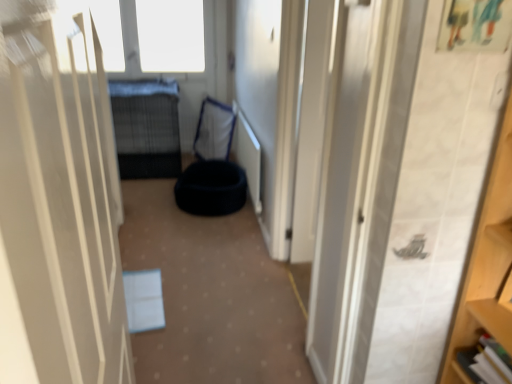
Question: From a real-world perspective, is black fabric bean bag at center, the 1th bean bag chair positioned from the front, beneath black fabric bean bag at center, the 2th bean bag chair positioned from the front?

Choices:
 (A) no
 (B) yes

Answer: (B)

Question: Considering the relative sizes of black fabric bean bag at center, the 1th bean bag chair positioned from the front, and black fabric bean bag at center, the 1th bean bag chair in the back-to-front sequence, in the image provided, is black fabric bean bag at center, the 1th bean bag chair positioned from the front, wider than black fabric bean bag at center, the 1th bean bag chair in the back-to-front sequence,?

Choices:
 (A) no
 (B) yes

Answer: (B)

Question: Is black fabric bean bag at center, arranged as the second bean bag chair when viewed from the back, further to camera compared to black fabric bean bag at center, the 2th bean bag chair positioned from the front?

Choices:
 (A) no
 (B) yes

Answer: (A)

Question: Does black fabric bean bag at center, the 1th bean bag chair positioned from the front, lie in front of black fabric bean bag at center, the 2th bean bag chair positioned from the front?

Choices:
 (A) yes
 (B) no

Answer: (A)

Question: Is black fabric bean bag at center, the 1th bean bag chair positioned from the front, thinner than black fabric bean bag at center, the 2th bean bag chair positioned from the front?

Choices:
 (A) yes
 (B) no

Answer: (B)

Question: Considering their positions, is white matte door at center located in front of or behind black wire mesh bed at center?

Choices:
 (A) behind
 (B) front

Answer: (B)

Question: In terms of width, does white matte door at center look wider or thinner when compared to black wire mesh bed at center?

Choices:
 (A) thin
 (B) wide

Answer: (A)

Question: Is point (110, 220) positioned closer to the camera than point (175, 132)?

Choices:
 (A) closer
 (B) farther

Answer: (A)

Question: Based on their sizes in the image, would you say white matte door at center is bigger or smaller than black wire mesh bed at center?

Choices:
 (A) big
 (B) small

Answer: (B)

Question: Is blue fabric pet bed at center wider or thinner than white matte door at center?

Choices:
 (A) wide
 (B) thin

Answer: (A)

Question: Is point (161, 183) positioned closer to the camera than point (8, 165)?

Choices:
 (A) closer
 (B) farther

Answer: (B)

Question: Looking at the image, does blue fabric pet bed at center seem bigger or smaller compared to white matte door at center?

Choices:
 (A) big
 (B) small

Answer: (A)

Question: Do you think blue fabric pet bed at center is within white matte door at center, or outside of it?

Choices:
 (A) inside
 (B) outside

Answer: (B)

Question: From a real-world perspective, is black wire mesh bed at center positioned above or below black fabric bean bag at center, the 2th bean bag chair positioned from the front?

Choices:
 (A) below
 (B) above

Answer: (B)

Question: Is black wire mesh bed at center to the left or to the right of black fabric bean bag at center, the 2th bean bag chair positioned from the front, in the image?

Choices:
 (A) right
 (B) left

Answer: (B)